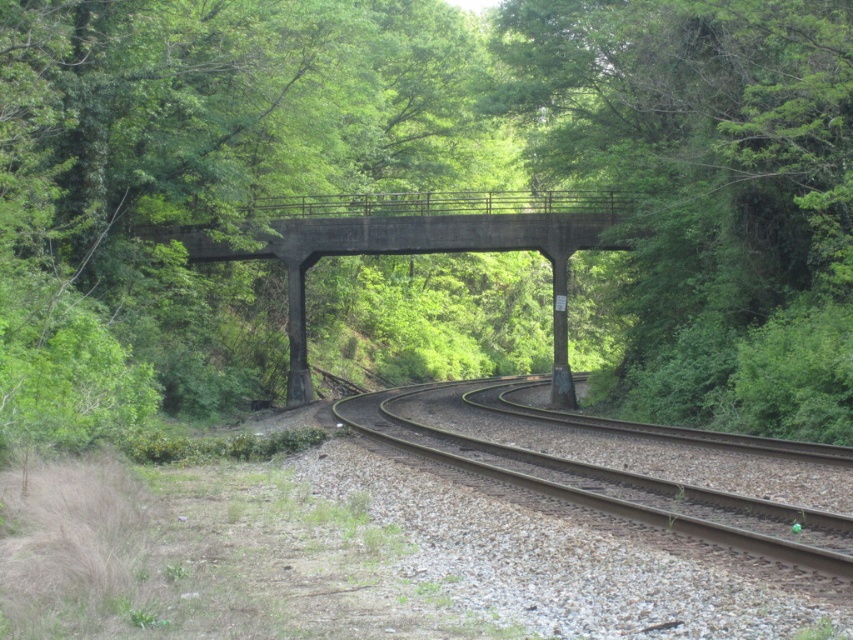
You are a train engineer observing the railway scene. You notice the green leafy tree at center and the concrete bridge at center. Which object is taller in the image?

The green leafy tree at center is taller than the concrete bridge at center according to the description.